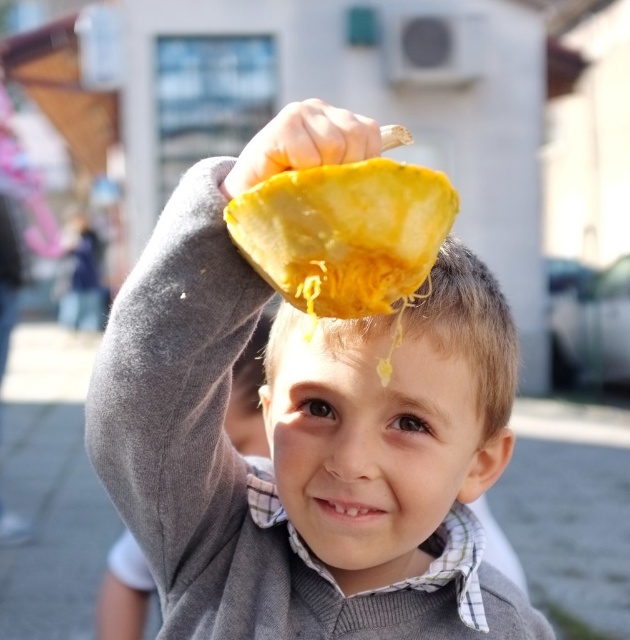
Between point (444, 490) and point (507, 404), which one is positioned behind?

The point (507, 404) is behind.

Does smooth yellow squash at upper center have a lesser width compared to yellow matte pumpkin at upper center?

Incorrect, smooth yellow squash at upper center's width is not less than yellow matte pumpkin at upper center's.

What are the coordinates of `smooth yellow squash at upper center` in the screenshot? It's located at (304, 429).

I want to click on smooth yellow squash at upper center, so click(x=304, y=429).

Is yellow soft pumpkin at center in front of smooth yellow fruit at upper center?

Yes, it is in front of smooth yellow fruit at upper center.

Between yellow soft pumpkin at center and smooth yellow fruit at upper center, which one is positioned higher?

smooth yellow fruit at upper center is above.

Is point (275, 195) farther from camera compared to point (341, 113)?

No, (275, 195) is in front of (341, 113).

This screenshot has height=640, width=630. What are the coordinates of `yellow soft pumpkin at center` in the screenshot? It's located at (x=345, y=234).

Does yellow matte pumpkin at upper center have a lesser width compared to smooth yellow fruit at upper center?

No.

Is yellow matte pumpkin at upper center positioned in front of smooth yellow fruit at upper center?

No, it is not.

Image resolution: width=630 pixels, height=640 pixels. What do you see at coordinates (469, 326) in the screenshot? I see `yellow matte pumpkin at upper center` at bounding box center [469, 326].

The image size is (630, 640). What are the coordinates of `yellow matte pumpkin at upper center` in the screenshot? It's located at (469, 326).